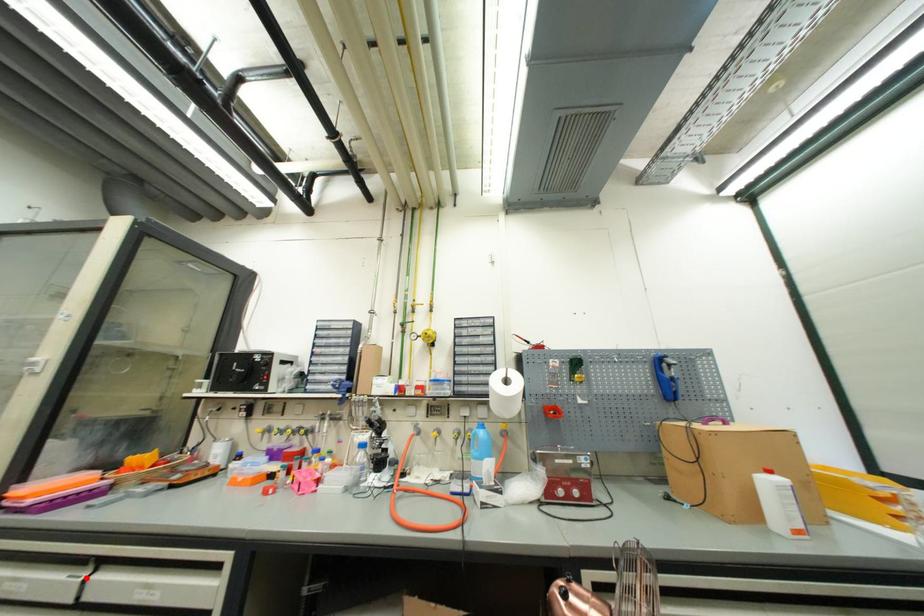
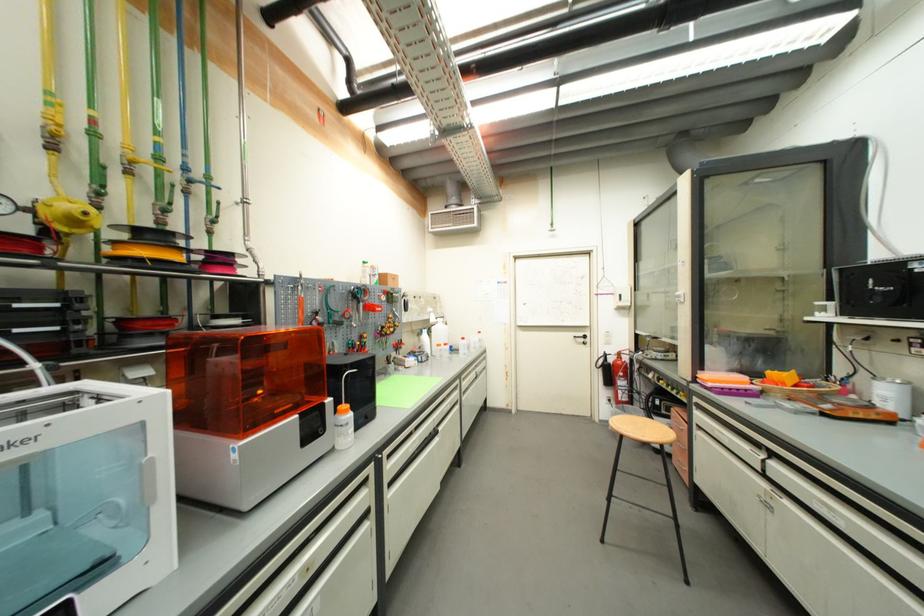
Question: I am providing you with two images of the same scene from different viewpoints. Given a red point in image1, look at the same physical point in image2. Is it:

Choices:
 (A) Closer to the viewpoint
 (B) Farther from the viewpoint

Answer: (B)